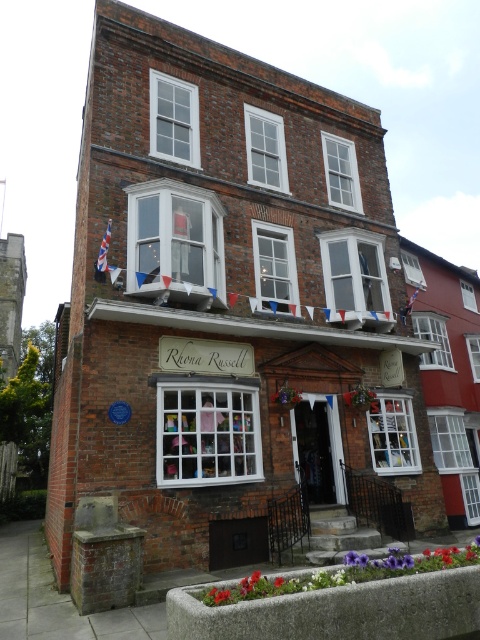
Is union jack fabric flag at upper left in front of blue fabric flag at upper center?

Yes, union jack fabric flag at upper left is in front of blue fabric flag at upper center.

Does union jack fabric flag at upper left appear over blue fabric flag at upper center?

Correct, union jack fabric flag at upper left is located above blue fabric flag at upper center.

Does point (99, 262) lie behind point (410, 298)?

That is False.

Identify the location of union jack fabric flag at upper left. (104, 250).